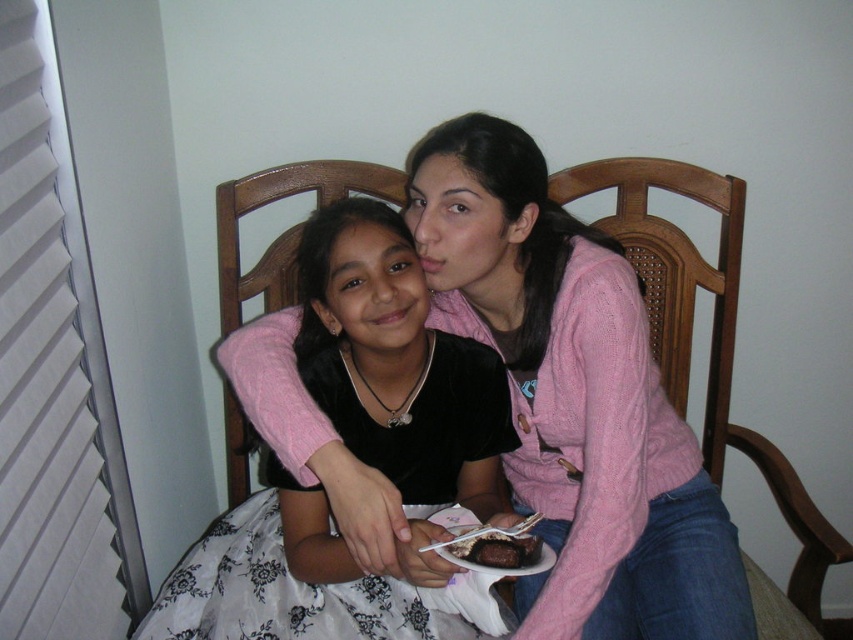
You are planning to place a small decorative bowl on the table between the wooden chair at center and the chocolate cake at center. Considering the sizes of the objects, will the bowl fit comfortably without overcrowding the space?

The wooden chair at center is larger than the chocolate cake at center. Since the chair is bigger, there might be enough space between them to place the bowl comfortably without overcrowding.

You are a photographer setting up for a family photo shoot. You need to position a spotlight at point 0.7 on the x and 0.4 on the y axis to highlight the black velvet dress at center. Will the spotlight hit the dress?

The black velvet dress at center is located at point (352, 454), so yes, the spotlight at 0.7 and 0.4 will hit the dress since the coordinates are very close.

You are a photographer setting up for a family photo. You see the wooden chair at center and the chocolate cake at center in the scene. Which object is closer to the camera?

The wooden chair at center is closer to the camera because the chocolate cake at center is behind it.